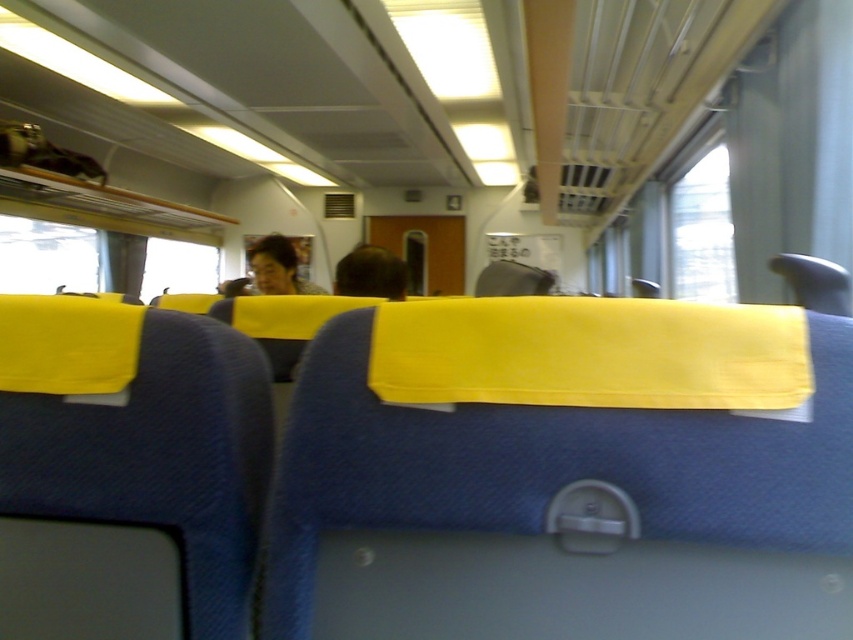
Between point (376, 260) and point (265, 285), which one is positioned behind?

The point (265, 285) is more distant.

Is point (370, 268) closer to camera compared to point (292, 257)?

Yes, it is.

Identify the location of brown hair at center. (370, 273).